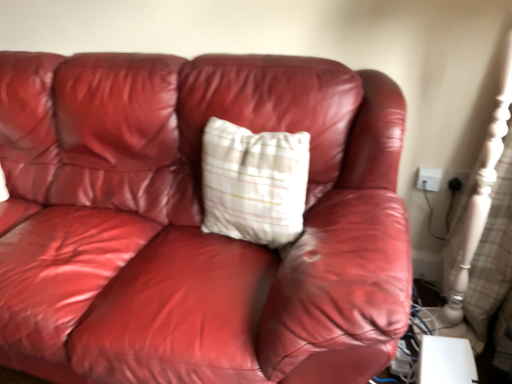
In order to face plaid fabric pillow at center, should I rotate leftwards or rightwards?

Turn left approximately 1.014 degrees to face it.

The image size is (512, 384). Identify the location of black plastic outlet at upper right, the 2th electric outlet positioned from the left. (457, 181).

Which of these two, plaid fabric pillow at center or white plastic electric outlet at upper right, which is counted as the 2th electric outlet, starting from the right, is smaller?

white plastic electric outlet at upper right, which is counted as the 2th electric outlet, starting from the right, is smaller.

Considering the sizes of plaid fabric pillow at center and white plastic electric outlet at upper right, arranged as the 1th electric outlet when viewed from the left, in the image, is plaid fabric pillow at center taller or shorter than white plastic electric outlet at upper right, arranged as the 1th electric outlet when viewed from the left,?

In the image, plaid fabric pillow at center appears to be taller than white plastic electric outlet at upper right, arranged as the 1th electric outlet when viewed from the left.

Is the depth of plaid fabric pillow at center greater than that of white plastic electric outlet at upper right, arranged as the 1th electric outlet when viewed from the left?

No.

How different are the orientations of white plastic electric outlet at upper right, which is counted as the 2th electric outlet, starting from the right, and black plastic outlet at upper right, the 1th electric outlet positioned from the right, in degrees?

The facing directions of white plastic electric outlet at upper right, which is counted as the 2th electric outlet, starting from the right, and black plastic outlet at upper right, the 1th electric outlet positioned from the right, are 0.016 degrees apart.

Is white plastic electric outlet at upper right, arranged as the 1th electric outlet when viewed from the left, smaller than black plastic outlet at upper right, the 2th electric outlet positioned from the left?

No, white plastic electric outlet at upper right, arranged as the 1th electric outlet when viewed from the left, is not smaller than black plastic outlet at upper right, the 2th electric outlet positioned from the left.

Considering the sizes of objects white plastic electric outlet at upper right, arranged as the 1th electric outlet when viewed from the left, and black plastic outlet at upper right, the 1th electric outlet positioned from the right, in the image provided, who is wider, white plastic electric outlet at upper right, arranged as the 1th electric outlet when viewed from the left, or black plastic outlet at upper right, the 1th electric outlet positioned from the right,?

With larger width is white plastic electric outlet at upper right, arranged as the 1th electric outlet when viewed from the left.

Is white plastic electric outlet at upper right, which is counted as the 2th electric outlet, starting from the right, situated inside black plastic outlet at upper right, the 1th electric outlet positioned from the right, or outside?

white plastic electric outlet at upper right, which is counted as the 2th electric outlet, starting from the right, is not inside black plastic outlet at upper right, the 1th electric outlet positioned from the right, it's outside.

Does black plastic outlet at upper right, the 2th electric outlet positioned from the left, have a greater height compared to white plastic electric outlet at upper right, which is counted as the 2th electric outlet, starting from the right?

In fact, black plastic outlet at upper right, the 2th electric outlet positioned from the left, may be shorter than white plastic electric outlet at upper right, which is counted as the 2th electric outlet, starting from the right.

Looking at their sizes, would you say black plastic outlet at upper right, the 2th electric outlet positioned from the left, is wider or thinner than white plastic electric outlet at upper right, which is counted as the 2th electric outlet, starting from the right?

Clearly, black plastic outlet at upper right, the 2th electric outlet positioned from the left, has less width compared to white plastic electric outlet at upper right, which is counted as the 2th electric outlet, starting from the right.

In order to click on electric outlet on the left of black plastic outlet at upper right, the 1th electric outlet positioned from the right in this screenshot , I will do `click(429, 178)`.

Considering the sizes of black plastic outlet at upper right, the 2th electric outlet positioned from the left, and plaid fabric pillow at center in the image, is black plastic outlet at upper right, the 2th electric outlet positioned from the left, taller or shorter than plaid fabric pillow at center?

Considering their sizes, black plastic outlet at upper right, the 2th electric outlet positioned from the left, has less height than plaid fabric pillow at center.

Considering the sizes of objects black plastic outlet at upper right, the 1th electric outlet positioned from the right, and plaid fabric pillow at center in the image provided, who is thinner, black plastic outlet at upper right, the 1th electric outlet positioned from the right, or plaid fabric pillow at center?

black plastic outlet at upper right, the 1th electric outlet positioned from the right, is thinner.

Which is more to the right, black plastic outlet at upper right, the 1th electric outlet positioned from the right, or plaid fabric pillow at center?

From the viewer's perspective, black plastic outlet at upper right, the 1th electric outlet positioned from the right, appears more on the right side.

How far apart are black plastic outlet at upper right, the 1th electric outlet positioned from the right, and plaid fabric pillow at center?

A distance of 32.94 inches exists between black plastic outlet at upper right, the 1th electric outlet positioned from the right, and plaid fabric pillow at center.

Can you confirm if plaid fabric pillow at center is shorter than black plastic outlet at upper right, the 1th electric outlet positioned from the right?

Incorrect, the height of plaid fabric pillow at center does not fall short of that of black plastic outlet at upper right, the 1th electric outlet positioned from the right.

From a real-world perspective, between plaid fabric pillow at center and black plastic outlet at upper right, the 1th electric outlet positioned from the right, who is vertically lower?

black plastic outlet at upper right, the 1th electric outlet positioned from the right, is physically lower.

Is black plastic outlet at upper right, the 2th electric outlet positioned from the left, completely or partially inside plaid fabric pillow at center?

No, black plastic outlet at upper right, the 2th electric outlet positioned from the left, is located outside of plaid fabric pillow at center.

This screenshot has height=384, width=512. In order to click on the 2nd electric outlet behind the plaid fabric pillow at center, starting your count from the anchor in this screenshot , I will do `click(429, 178)`.

Is white plastic electric outlet at upper right, which is counted as the 2th electric outlet, starting from the right, positioned behind plaid fabric pillow at center?

Yes, white plastic electric outlet at upper right, which is counted as the 2th electric outlet, starting from the right, is further from the viewer.

Which of these two, white plastic electric outlet at upper right, arranged as the 1th electric outlet when viewed from the left, or plaid fabric pillow at center, is wider?

Wider between the two is plaid fabric pillow at center.

Measure the distance from white plastic electric outlet at upper right, which is counted as the 2th electric outlet, starting from the right, to plaid fabric pillow at center.

A distance of 76.97 centimeters exists between white plastic electric outlet at upper right, which is counted as the 2th electric outlet, starting from the right, and plaid fabric pillow at center.

Locate an element on the screen. This screenshot has height=384, width=512. pillow located below the white plastic electric outlet at upper right, which is counted as the 2th electric outlet, starting from the right (from the image's perspective) is located at coordinates (254, 183).

The height and width of the screenshot is (384, 512). Identify the location of electric outlet on the left of black plastic outlet at upper right, the 1th electric outlet positioned from the right. (429, 178).

When comparing their distances from black plastic outlet at upper right, the 2th electric outlet positioned from the left, does white plastic electric outlet at upper right, arranged as the 1th electric outlet when viewed from the left, or plaid fabric pillow at center seem closer?

Among the two, white plastic electric outlet at upper right, arranged as the 1th electric outlet when viewed from the left, is located nearer to black plastic outlet at upper right, the 2th electric outlet positioned from the left.

When comparing their distances from white plastic electric outlet at upper right, arranged as the 1th electric outlet when viewed from the left, does plaid fabric pillow at center or black plastic outlet at upper right, the 2th electric outlet positioned from the left, seem further?

Based on the image, plaid fabric pillow at center appears to be further to white plastic electric outlet at upper right, arranged as the 1th electric outlet when viewed from the left.

When comparing their distances from white plastic electric outlet at upper right, which is counted as the 2th electric outlet, starting from the right, does black plastic outlet at upper right, the 1th electric outlet positioned from the right, or plaid fabric pillow at center seem further?

Among the two, plaid fabric pillow at center is located further to white plastic electric outlet at upper right, which is counted as the 2th electric outlet, starting from the right.

Looking at this image, when comparing their distances from black plastic outlet at upper right, the 2th electric outlet positioned from the left, does plaid fabric pillow at center or white plastic electric outlet at upper right, arranged as the 1th electric outlet when viewed from the left, seem further?

plaid fabric pillow at center.

Estimate the real-world distances between objects in this image. Which object is further from plaid fabric pillow at center, white plastic electric outlet at upper right, arranged as the 1th electric outlet when viewed from the left, or black plastic outlet at upper right, the 1th electric outlet positioned from the right?

black plastic outlet at upper right, the 1th electric outlet positioned from the right, is further to plaid fabric pillow at center.

Estimate the real-world distances between objects in this image. Which object is closer to plaid fabric pillow at center, black plastic outlet at upper right, the 1th electric outlet positioned from the right, or white plastic electric outlet at upper right, which is counted as the 2th electric outlet, starting from the right?

Among the two, white plastic electric outlet at upper right, which is counted as the 2th electric outlet, starting from the right, is located nearer to plaid fabric pillow at center.

This screenshot has height=384, width=512. Identify the location of electric outlet located between plaid fabric pillow at center and black plastic outlet at upper right, the 1th electric outlet positioned from the right, in the left-right direction. (429, 178).